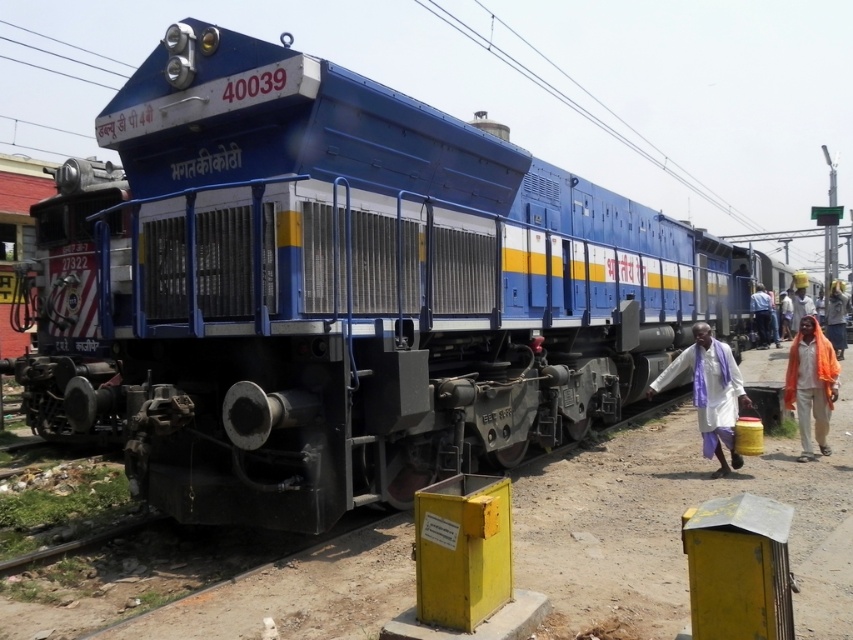
You are standing in front of the blue locomotive numbered 40039 and notice two points marked on it. The first point is at coordinate point (807, 426) and the second point is at coordinate point (766, 332). Which of these two points is nearer to you?

Point (807, 426) is closer to the camera than point (766, 332), so the first point is nearer to you.

You are a railway worker inspecting the area around the blue locomotive 40039. You notice two cloths, the orange cloth at right and the white cloth at center. Which cloth is positioned lower in relation to the other?

The orange cloth at right is below the white cloth at center, so the orange cloth at right is positioned lower than the white cloth at center.

You are a passenger on the train and you see two white cloths in the scene. One is the white cotton cloth at lower right and the other is the white cloth at center. Which one is shorter in height?

The white cotton cloth at lower right has a lesser height compared to the white cloth at center, so the white cotton cloth at lower right is shorter in height.